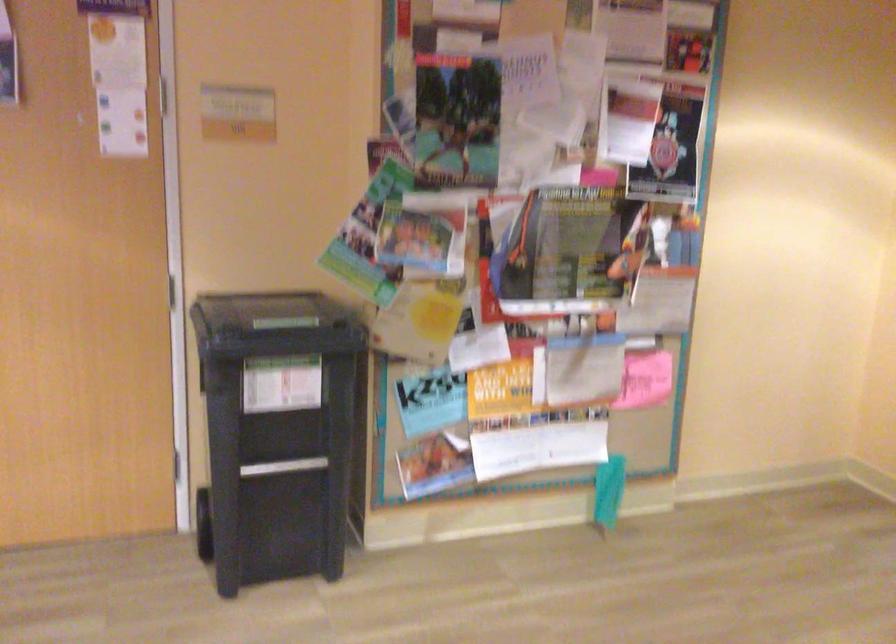
You are a GUI agent. You are given a task and a screenshot of the screen. Output one action in this format:
    pyautogui.click(x=<x>, y=<y>)
    Task: Click on the trash can handle
    Image resolution: width=896 pixels, height=644 pixels.
    Given the screenshot: What is the action you would take?
    pyautogui.click(x=283, y=466)